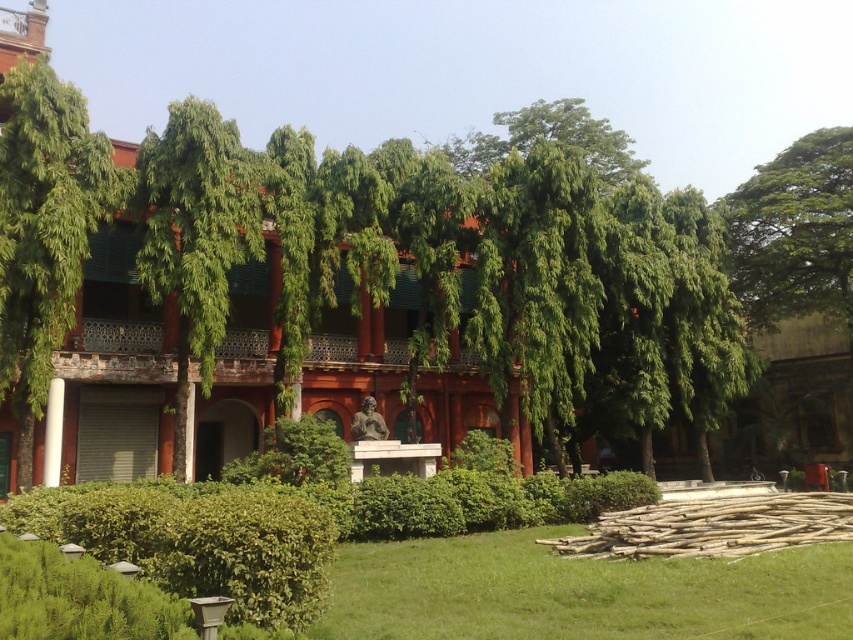
You are planning to install a new bench in the garden area in front of the building. The bench requires a space of 60 feet between two trees to be placed safely. Given the green leafy tree at left and the green leafy tree at upper right, can the bench be placed between them?

The distance between the green leafy tree at left and the green leafy tree at upper right is 70.51 feet, which is greater than the required 60 feet. Therefore, the bench can be placed between them.

You are standing in front of the building and want to determine the distance between two points marked on the lawn. The first point is at coordinate point[13,298] and the second is at point[838,173]. Based on the scene description, which point is closer to you?

Point[13,298] is closer to the viewer than point[838,173].